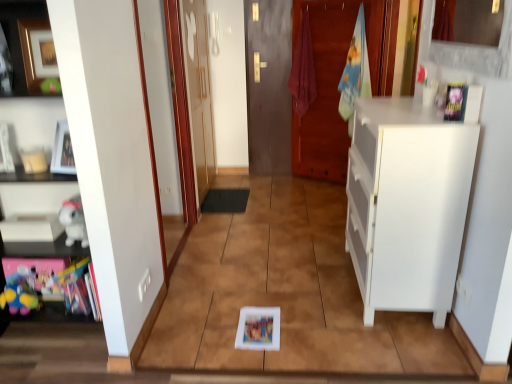
Question: Is matte red towel at center, the second laundry in the right-to-left sequence, wider or thinner than transparent glass door at upper left, acting as the 2th door starting from the right?

Choices:
 (A) thin
 (B) wide

Answer: (B)

Question: Considering the positions of matte red towel at center, acting as the first laundry starting from the left, and transparent glass door at upper left, the first door positioned from the left, in the image, is matte red towel at center, acting as the first laundry starting from the left, taller or shorter than transparent glass door at upper left, the first door positioned from the left,?

Choices:
 (A) tall
 (B) short

Answer: (B)

Question: Considering the real-world distances, which object is closest to the white plush toy at left, arranged as the 1th toy when viewed from the top?

Choices:
 (A) matte white picture frame at upper left
 (B) matte red towel at center, acting as the first laundry starting from the left
 (C) brown wooden door at center, which appears as the second door when viewed from the left
 (D) multicolored plush toy at lower left, marked as the first toy in a left-to-right arrangement
 (E) white matte cabinet at left, marked as the 2th cabinetry in a right-to-left arrangement

Answer: (E)

Question: Which of these objects is positioned farthest from the white matte cabinet at right, the first cabinetry viewed from the right?

Choices:
 (A) multicolored plush toy at lower left, arranged as the second toy when viewed from the right
 (B) matte red towel at center, the second laundry in the right-to-left sequence
 (C) white matte cabinet at left, the 1th cabinetry positioned from the left
 (D) brown wooden door at center, which appears as the first door when viewed from the right
 (E) transparent glass door at upper left, acting as the 2th door starting from the right

Answer: (D)